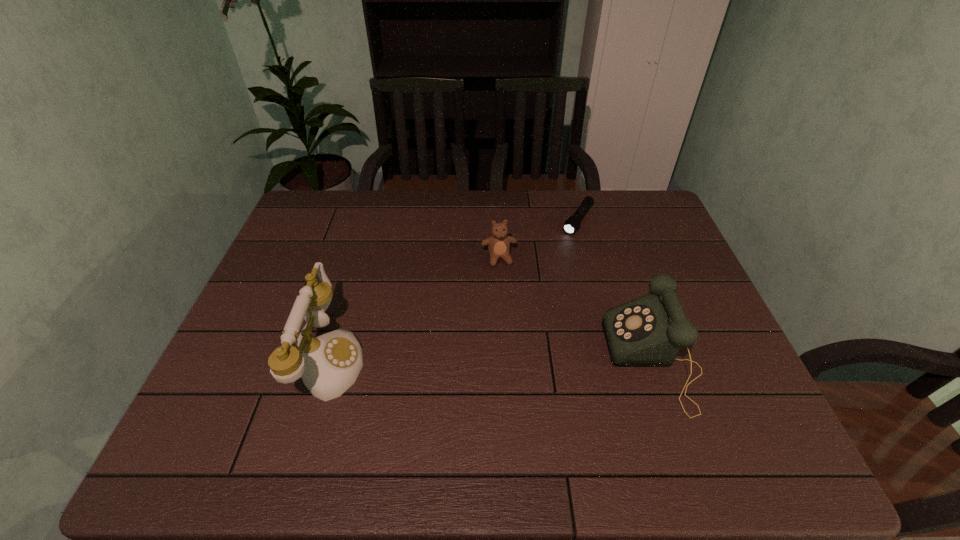
You are a GUI agent. You are given a task and a screenshot of the screen. Output one action in this format:
    pyautogui.click(x=<x>, y=<y>)
    Task: Click on the free point located on the dial of the shorter telephone
    The height and width of the screenshot is (540, 960).
    Given the screenshot: What is the action you would take?
    pyautogui.click(x=460, y=360)

Identify the location of vacant space situated on the dial of the shorter telephone. The image size is (960, 540). (547, 360).

At what (x,y) coordinates should I click in order to perform the action: click on vacant space located on the front-facing side of the third nearest object. Please return your answer as a coordinate pair (x, y). The image size is (960, 540). Looking at the image, I should click on (515, 323).

Identify the location of vacant space located 0.150m on the front-facing side of the third nearest object. This screenshot has height=540, width=960. (511, 306).

The height and width of the screenshot is (540, 960). What are the coordinates of `vacant area located on the front-facing side of the third nearest object` in the screenshot? It's located at (519, 345).

Locate an element on the screen. vacant space located at the lens end of the shortest object is located at coordinates (540, 281).

Where is `free spot located at the lens end of the shortest object`? free spot located at the lens end of the shortest object is located at coordinates (531, 294).

Identify the location of vacant space located 0.050m at the lens end of the shortest object. This screenshot has height=540, width=960. (565, 244).

At what (x,y) coordinates should I click in order to perform the action: click on object present at the far edge. Please return your answer as a coordinate pair (x, y). Looking at the image, I should click on (572, 224).

Image resolution: width=960 pixels, height=540 pixels. Identify the location of object that is at the left edge. (329, 364).